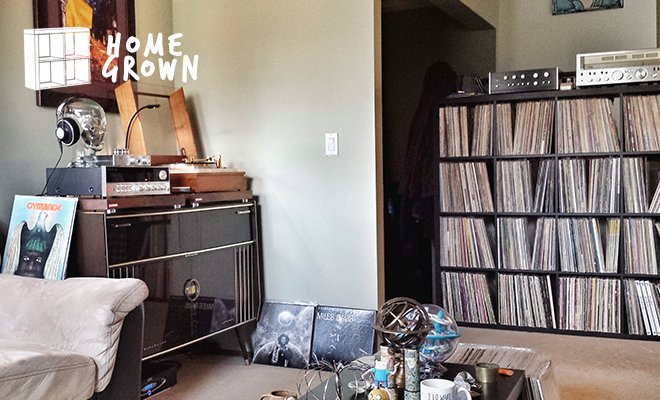
Where is `shelves`? Image resolution: width=660 pixels, height=400 pixels. shelves is located at coordinates (488, 155), (474, 211), (471, 264), (474, 322).